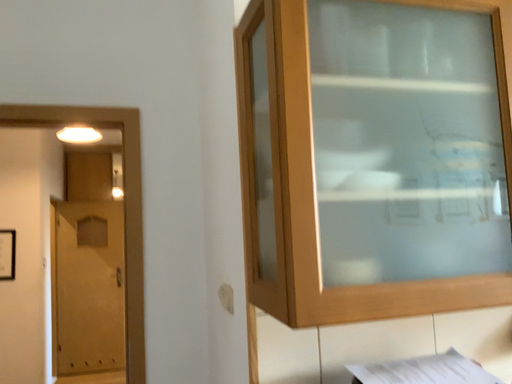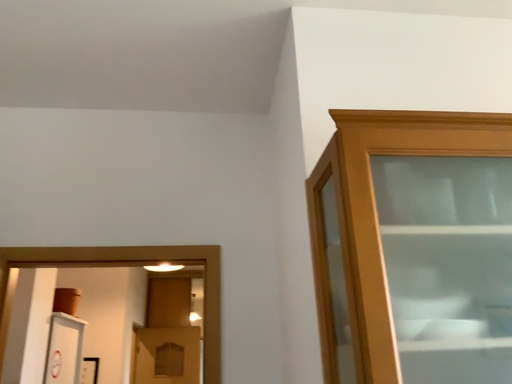
Question: How did the camera likely rotate when shooting the video?

Choices:
 (A) rotated left
 (B) rotated right

Answer: (A)